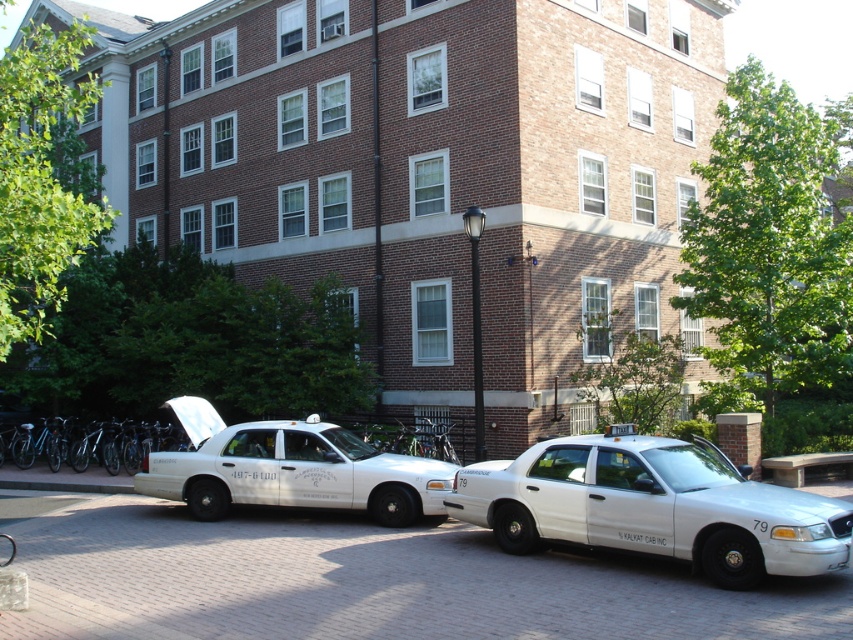
You are standing in front of the two white taxis parked in front of the brick building. You notice two points marked on the pavement. The first point is at coordinates point (787, 504) and the second point is at point (306, 451). Which point is closer to you?

Point (787, 504) is closer to the camera than point (306, 451).

Looking at this image, you are a delivery person needing to park a 2.5 meter wide delivery van between the white glossy sedan at center and the white glossy taxi at center. Can you fit the van there based on their widths?

The white glossy sedan at center is narrower than the white glossy taxi at center, but without knowing the exact distance between them or the total space available, it is impossible to determine if the 2.5 meter wide delivery van can fit between them.

You are standing in front of the two white taxis parked side by side in front of the multi story brick building. You notice two points marked on the image. The first point is at coordinate (431, 596) and the second point is at coordinate (212, 515). Which point is closer to you?

Point (431, 596) is closer to you than point (212, 515).